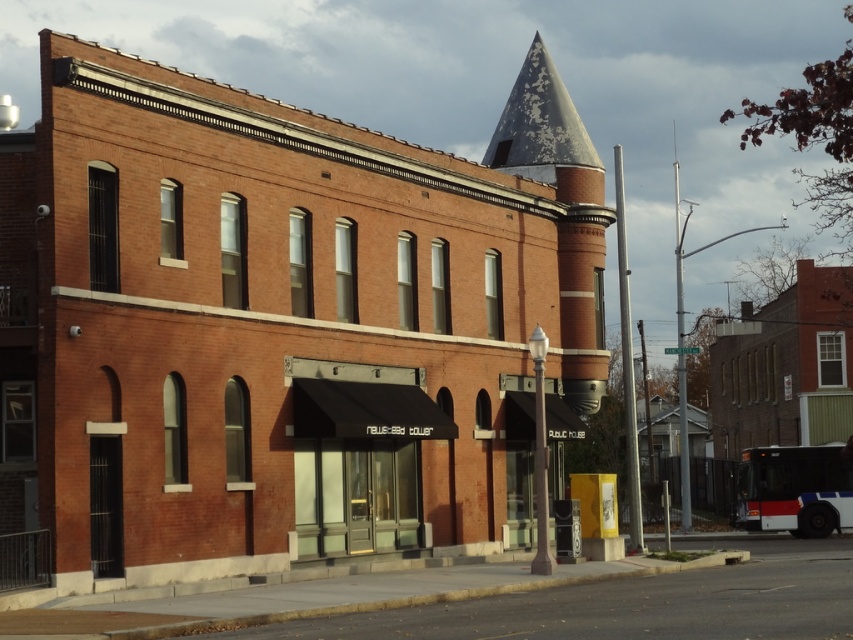
You are a delivery person trying to deliver a package to the News Press Tower. You need to identify the building based on its architectural features. Which object is smaller in size between the black fabric awning at center and the rusty metal spire at upper center?

The black fabric awning at center has a smaller size compared to the rusty metal spire at upper center, so the black fabric awning at center is the smaller one.

You are standing in front of the News Press Tower. There is a point marked at coordinates (360, 464) on the image. Where is this point located?

The point marked at coordinates (360, 464) is located on the black fabric awning at center.